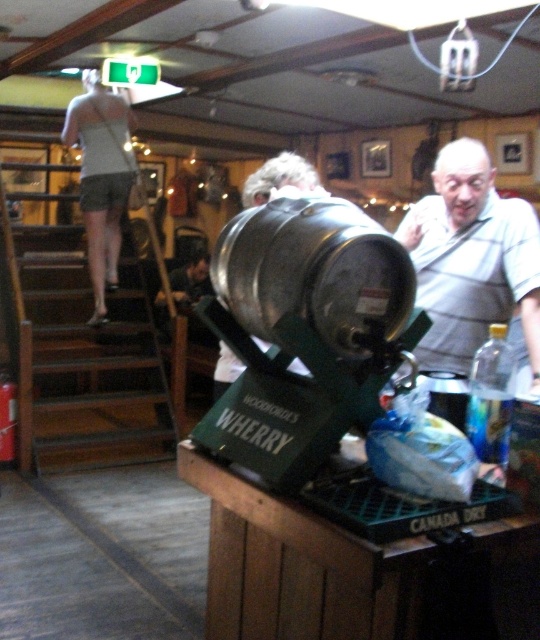
Question: Does shiny silver barrel at center have a lesser width compared to light gray fabric shorts at upper left?

Choices:
 (A) no
 (B) yes

Answer: (B)

Question: Which of the following is the farthest from the observer?

Choices:
 (A) (126, 157)
 (B) (253, 211)
 (C) (449, 349)

Answer: (A)

Question: Which is nearer to the gray striped shirt at upper right?

Choices:
 (A) shiny silver barrel at center
 (B) light gray fabric shorts at upper left

Answer: (A)

Question: Does gray striped shirt at upper right have a greater width compared to light gray fabric shorts at upper left?

Choices:
 (A) yes
 (B) no

Answer: (B)

Question: Which object is farther from the camera taking this photo?

Choices:
 (A) light gray fabric shorts at upper left
 (B) gray striped shirt at upper right

Answer: (A)

Question: Can you confirm if shiny silver barrel at center is smaller than gray striped shirt at upper right?

Choices:
 (A) yes
 (B) no

Answer: (A)